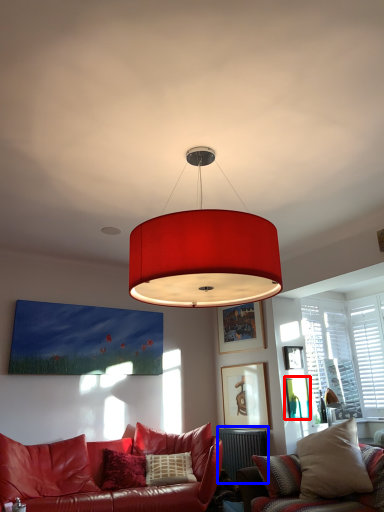
Question: Which of the following is the closest to the observer, picture frame (highlighted by a red box) or radiator (highlighted by a blue box)?

Choices:
 (A) picture frame
 (B) radiator

Answer: (B)